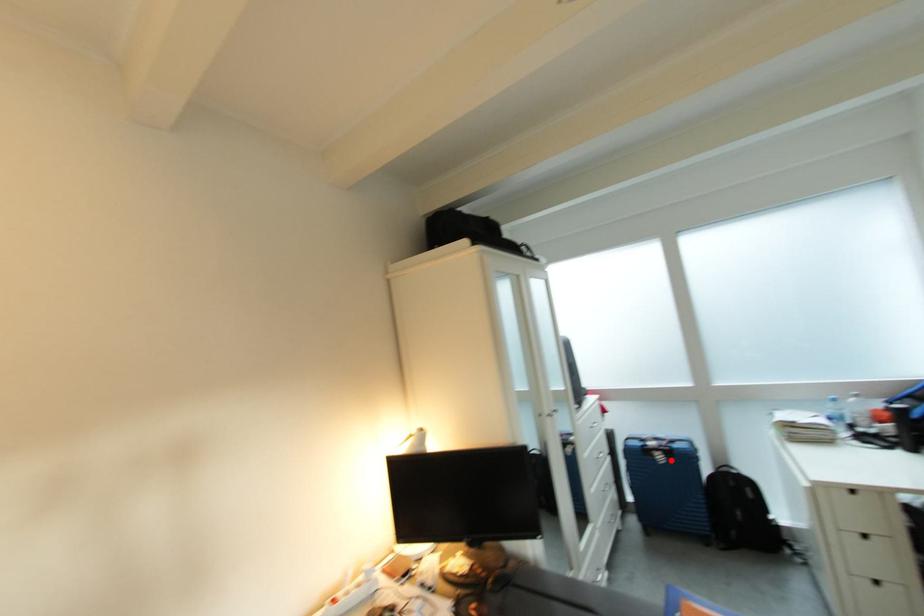
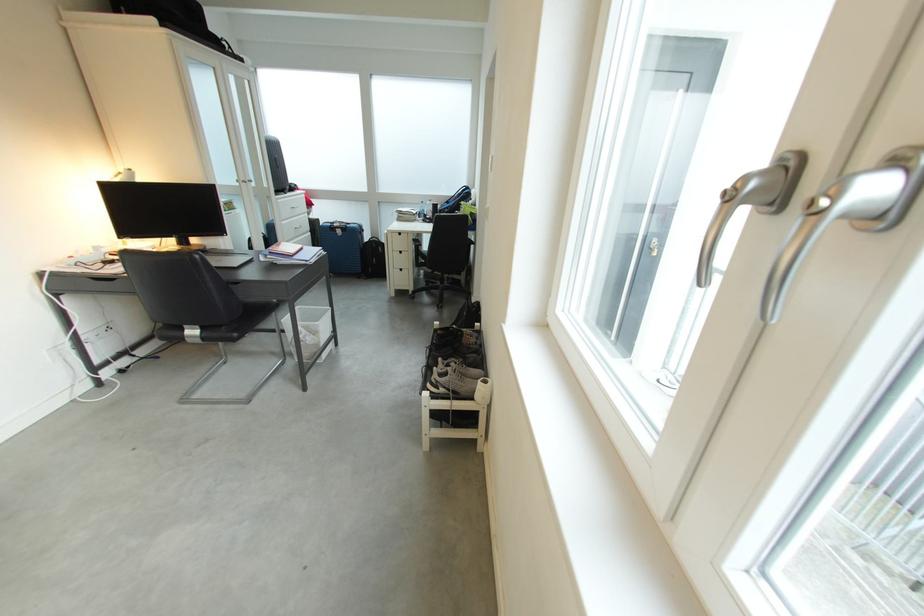
Question: I am providing you with two images of the same scene from different viewpoints. Given a red point in image1, look at the same physical point in image2. Is it:

Choices:
 (A) Closer to the viewpoint
 (B) Farther from the viewpoint

Answer: (A)